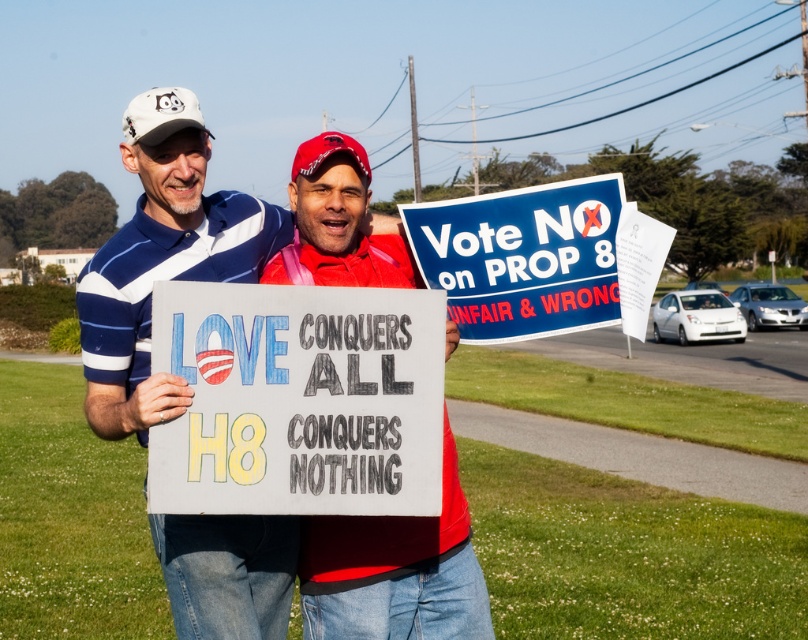
Based on the photo, who is positioned more to the left, hand-drawn paper sign at center or white plastic sign at center?

Positioned to the left is white plastic sign at center.

From the picture: Is hand-drawn paper sign at center taller than white plastic sign at center?

Incorrect, hand-drawn paper sign at center's height is not larger of white plastic sign at center's.

Is point (346, 458) in front of point (163, 250)?

Yes, point (346, 458) is closer to viewer.

Image resolution: width=808 pixels, height=640 pixels. In order to click on hand-drawn paper sign at center in this screenshot , I will do `click(297, 400)`.

Which is below, hand-drawn paper sign at center or blue paper sign at upper center?

hand-drawn paper sign at center is below.

Which is behind, point (272, 330) or point (609, 186)?

The point (609, 186) is more distant.

This screenshot has height=640, width=808. I want to click on hand-drawn paper sign at center, so click(x=297, y=400).

How far apart are white plastic sign at center and blue paper sign at upper center?

16.99 inches

The width and height of the screenshot is (808, 640). Describe the element at coordinates (162, 259) in the screenshot. I see `white plastic sign at center` at that location.

Who is more distant from viewer, [198,157] or [564,184]?

Point [564,184]

Identify the location of white plastic sign at center. (162, 259).